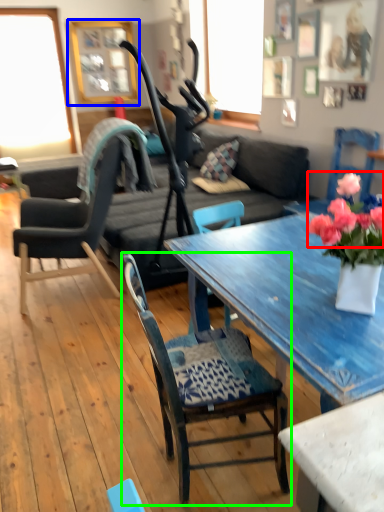
Question: Based on their relative distances, which object is nearer to flower (highlighted by a red box)? Choose from picture frame (highlighted by a blue box) and chair (highlighted by a green box).

Choices:
 (A) picture frame
 (B) chair

Answer: (B)